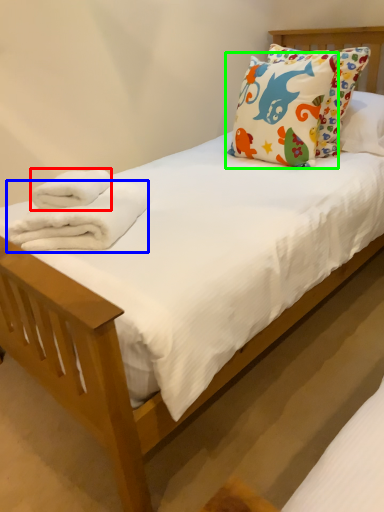
Question: Based on their relative distances, which object is nearer to bath towel (highlighted by a red box)? Choose from bath towel (highlighted by a blue box) and pillow (highlighted by a green box).

Choices:
 (A) bath towel
 (B) pillow

Answer: (A)